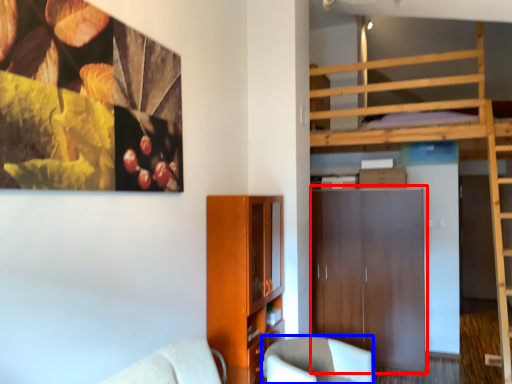
Question: Among these objects, which one is farthest to the camera, dresser (highlighted by a red box) or chair (highlighted by a blue box)?

Choices:
 (A) dresser
 (B) chair

Answer: (A)